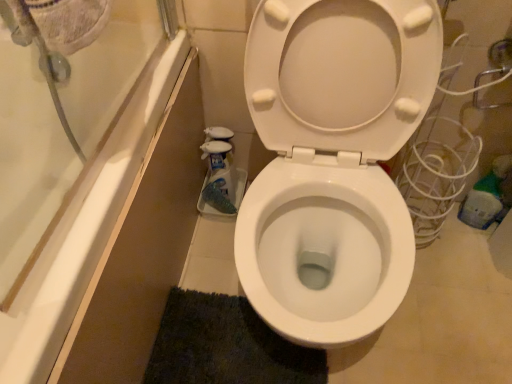
The image size is (512, 384). I want to click on vacant space that is in between white glossy toilet at center and dark blue textured bath mat at lower center, so click(x=218, y=268).